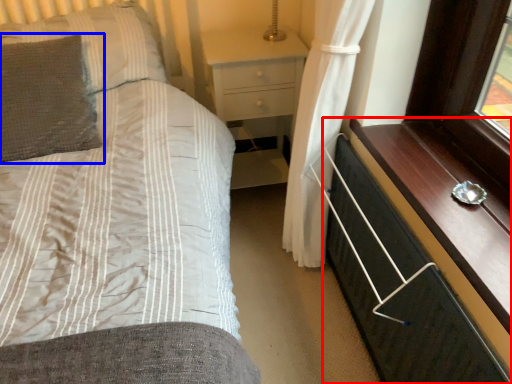
Question: Which point is closer to the camera, chest of drawers (highlighted by a red box) or pillow (highlighted by a blue box)?

Choices:
 (A) chest of drawers
 (B) pillow

Answer: (A)